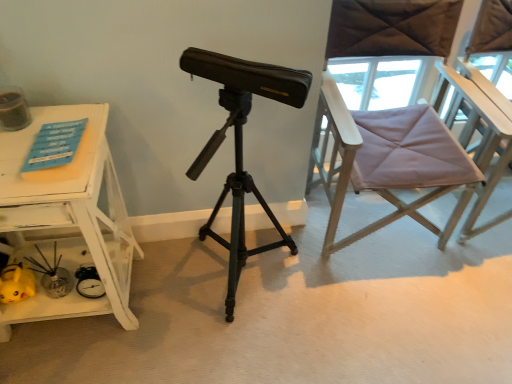
This screenshot has height=384, width=512. In order to click on vacant space in front of matte black tripod at center in this screenshot , I will do `click(248, 354)`.